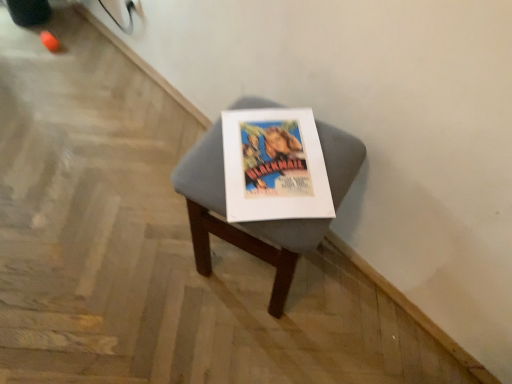
This screenshot has width=512, height=384. I want to click on empty space that is ontop of gray fabric stool at center, so click(274, 156).